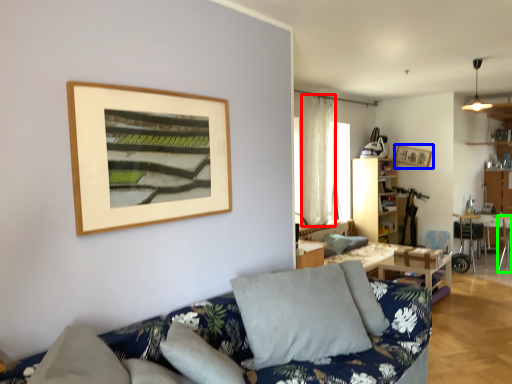
Question: Estimate the real-world distances between objects in this image. Which object is farther from curtain (highlighted by a red box), picture frame (highlighted by a blue box) or armchair (highlighted by a green box)?

Choices:
 (A) picture frame
 (B) armchair

Answer: (B)